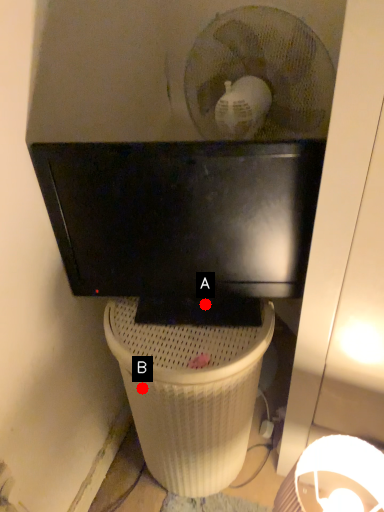
Question: Two points are circled on the image, labeled by A and B beside each circle. Which point appears closest to the camera in this image?

Choices:
 (A) A is closer
 (B) B is closer

Answer: (B)